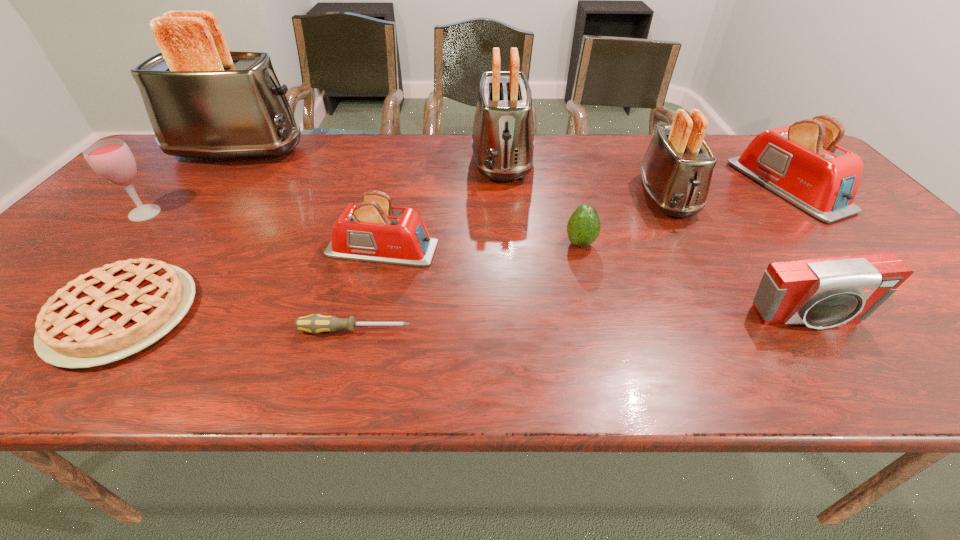
At what (x,y) coordinates should I click in order to perform the action: click on vacant area situated 0.310m on the side of the smallest gray toaster with the control lever. Please return your answer as a coordinate pair (x, y). This screenshot has height=540, width=960. Looking at the image, I should click on (732, 319).

This screenshot has width=960, height=540. I want to click on free location located on the front of the farther red toaster, so click(880, 287).

This screenshot has width=960, height=540. What are the coordinates of `free region located 0.090m on the front of the wineglass` in the screenshot? It's located at (114, 247).

This screenshot has width=960, height=540. I want to click on vacant space located 0.350m on the right of the left red toaster, so click(587, 249).

At what (x,y) coordinates should I click in order to perform the action: click on vacant position located on the front-facing side of the camera. Please return your answer as a coordinate pair (x, y). This screenshot has width=960, height=540. Looking at the image, I should click on (833, 356).

The width and height of the screenshot is (960, 540). What are the coordinates of `vacant space located 0.080m on the front of the eighth tallest object` in the screenshot? It's located at click(589, 278).

Find the location of a particular element. vacant position located on the back of the pie is located at coordinates (208, 204).

The width and height of the screenshot is (960, 540). What are the coordinates of `vacant space situated 0.400m at the tip of the gray screwdriver` in the screenshot? It's located at (614, 330).

The width and height of the screenshot is (960, 540). What are the coordinates of `object at the near edge` in the screenshot? It's located at [x=114, y=311].

The height and width of the screenshot is (540, 960). Find the location of `toaster located in the left edge section of the desktop`. toaster located in the left edge section of the desktop is located at coordinates (202, 100).